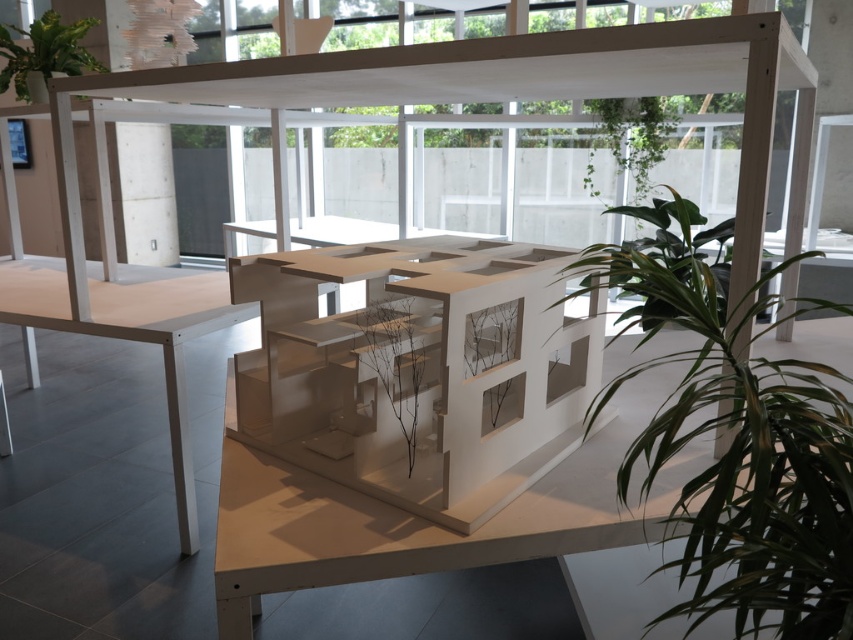
Is green leafy plant at center taller than green leafy plant at upper right?

Yes, green leafy plant at center is taller than green leafy plant at upper right.

Between point (749, 432) and point (605, 109), which one is positioned behind?

The point (605, 109) is behind.

Where is `green leafy plant at center`? This screenshot has height=640, width=853. green leafy plant at center is located at coordinates (735, 436).

Can you confirm if green leafy plant at center is taller than brown matte plant at center?

Correct, green leafy plant at center is much taller as brown matte plant at center.

Measure the distance between green leafy plant at center and camera.

green leafy plant at center and camera are 23.48 inches apart.

Who is more forward, (722, 348) or (408, 326)?

Point (722, 348)

You are a GUI agent. You are given a task and a screenshot of the screen. Output one action in this format:
    pyautogui.click(x=<x>, y=<y>)
    Task: Click on the green leafy plant at center
    The width and height of the screenshot is (853, 640).
    Given the screenshot: What is the action you would take?
    pyautogui.click(x=735, y=436)

Between green leafy plant at upper right and green matte plant at upper left, which one appears on the left side from the viewer's perspective?

green matte plant at upper left

Does green leafy plant at upper right appear under green matte plant at upper left?

Actually, green leafy plant at upper right is above green matte plant at upper left.

Between point (647, 125) and point (7, 26), which one is positioned in front?

Positioned in front is point (647, 125).

Where is `green leafy plant at upper right`? This screenshot has width=853, height=640. green leafy plant at upper right is located at coordinates (630, 138).